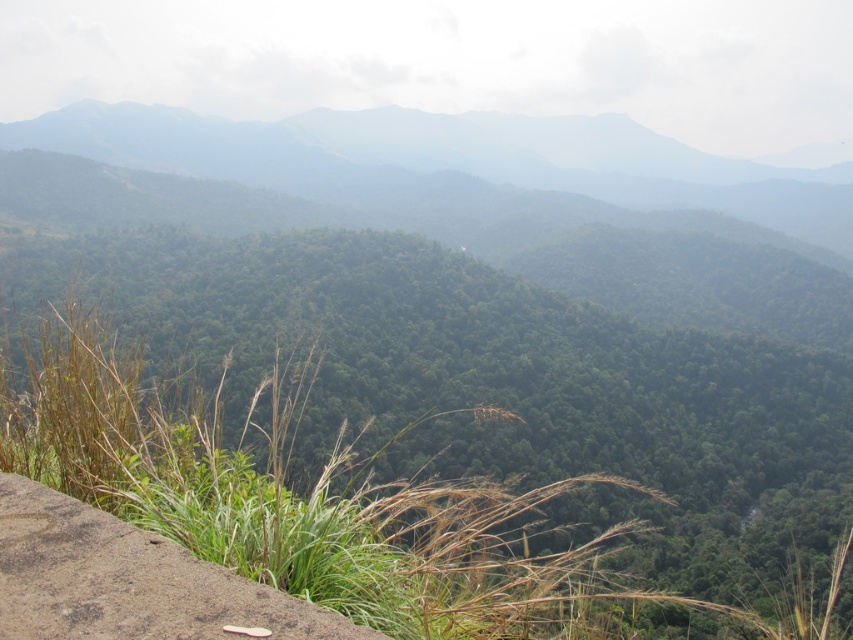
Is green leafy forest at center shorter than brown rough stone ledge at lower left?

No, green leafy forest at center is not shorter than brown rough stone ledge at lower left.

Does point (480, 147) come farther from viewer compared to point (155, 541)?

Yes, it is.

Locate an element on the screen. green leafy forest at center is located at coordinates (451, 161).

Where is `green leafy grass at lower left`? green leafy grass at lower left is located at coordinates (495, 381).

What are the coordinates of `green leafy grass at lower left` in the screenshot? It's located at click(495, 381).

Where is `green leafy grass at lower left`? This screenshot has height=640, width=853. green leafy grass at lower left is located at coordinates (495, 381).